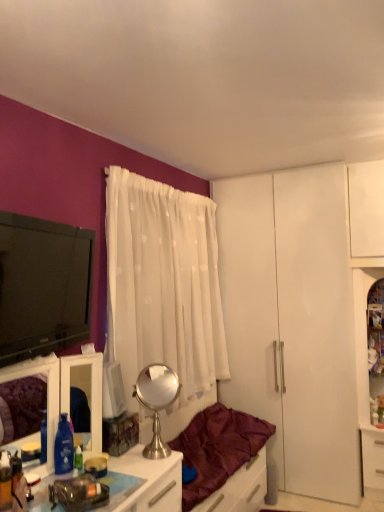
Question: From the image's perspective, is white sheer curtain at center located beneath clear glass cabinet at right?

Choices:
 (A) yes
 (B) no

Answer: (B)

Question: Does white sheer curtain at center have a greater height compared to clear glass cabinet at right?

Choices:
 (A) no
 (B) yes

Answer: (B)

Question: Are white sheer curtain at center and clear glass cabinet at right making contact?

Choices:
 (A) yes
 (B) no

Answer: (B)

Question: From a real-world perspective, is white sheer curtain at center under clear glass cabinet at right?

Choices:
 (A) no
 (B) yes

Answer: (A)

Question: Is white sheer curtain at center not near clear glass cabinet at right?

Choices:
 (A) no
 (B) yes

Answer: (B)

Question: Is white sheer curtain at center bigger than clear glass cabinet at right?

Choices:
 (A) no
 (B) yes

Answer: (B)

Question: Is metallic silver vanity at lower left to the left of translucent plastic desk at lower left from the viewer's perspective?

Choices:
 (A) no
 (B) yes

Answer: (B)

Question: Is metallic silver vanity at lower left closer to the viewer compared to translucent plastic desk at lower left?

Choices:
 (A) yes
 (B) no

Answer: (B)

Question: Is metallic silver vanity at lower left taller than translucent plastic desk at lower left?

Choices:
 (A) no
 (B) yes

Answer: (B)

Question: Considering the relative sizes of metallic silver vanity at lower left and translucent plastic desk at lower left in the image provided, is metallic silver vanity at lower left bigger than translucent plastic desk at lower left?

Choices:
 (A) no
 (B) yes

Answer: (B)

Question: Is metallic silver vanity at lower left shorter than translucent plastic desk at lower left?

Choices:
 (A) no
 (B) yes

Answer: (A)

Question: From the image's perspective, is metallic silver vanity at lower left beneath translucent plastic desk at lower left?

Choices:
 (A) no
 (B) yes

Answer: (A)

Question: Are white sheer curtain at center and white matte drawer at lower right making contact?

Choices:
 (A) yes
 (B) no

Answer: (B)